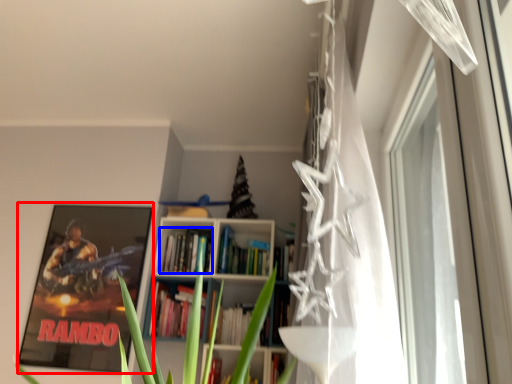
Question: Which object is further to the camera taking this photo, picture frame (highlighted by a red box) or book (highlighted by a blue box)?

Choices:
 (A) picture frame
 (B) book

Answer: (B)